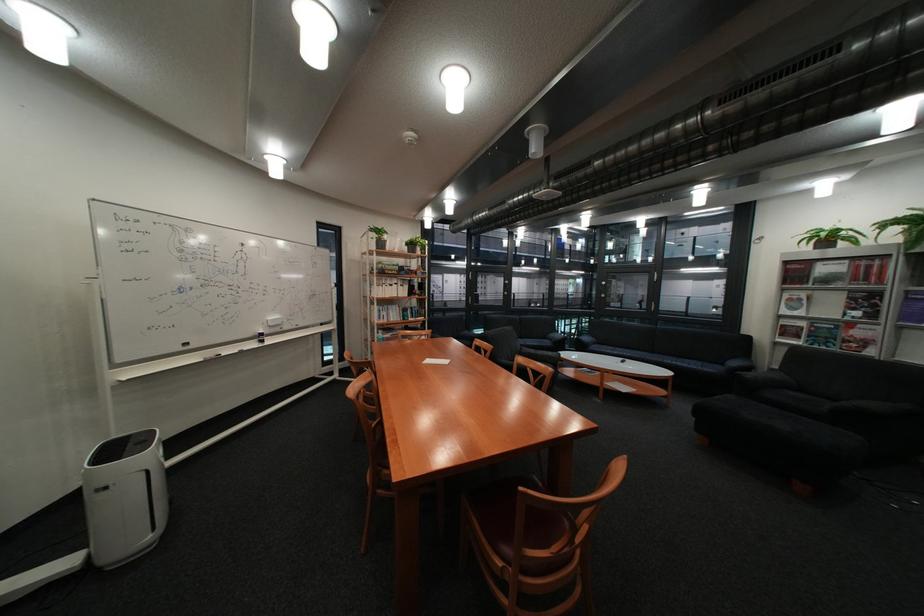
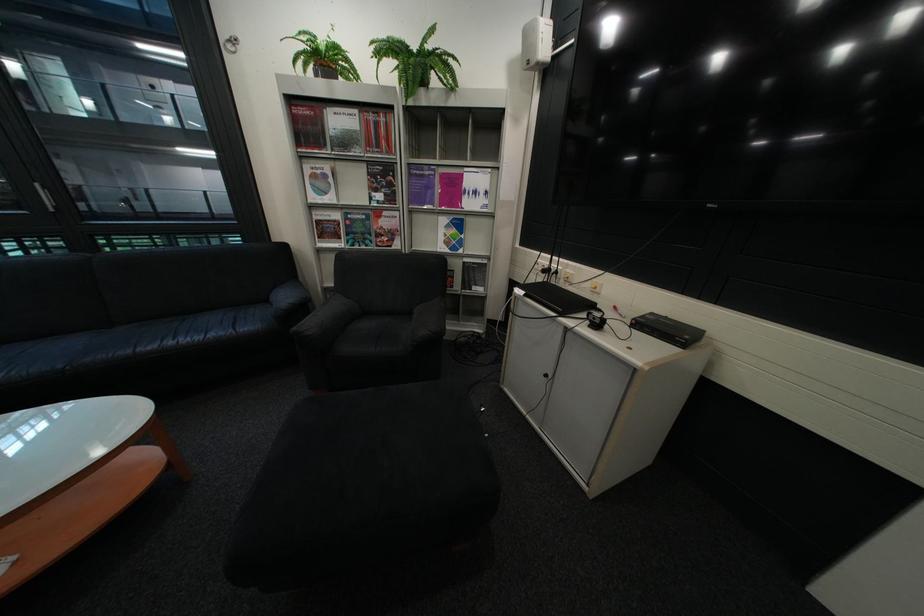
In the second image, find the point that corresponds to (805,300) in the first image.

(329, 177)